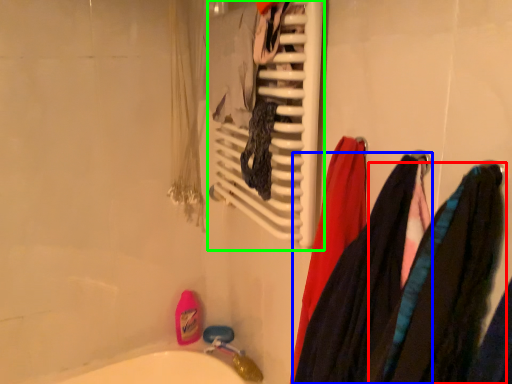
Question: Based on their relative distances, which object is farther from clothing (highlighted by a red box)? Choose from clothing (highlighted by a blue box) and towel rack (highlighted by a green box).

Choices:
 (A) clothing
 (B) towel rack

Answer: (B)